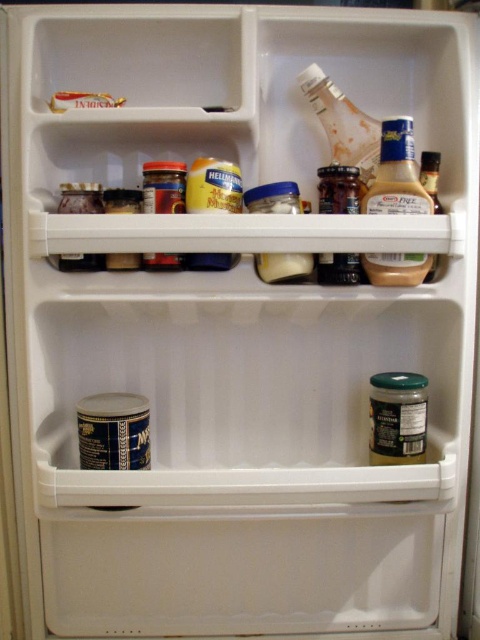
What is located at the coordinates point (274, 198) in the refrigerator?

The point (274, 198) marks a matte plastic jar at center.

You are looking at the refrigerator shelves from the front. There are two points marked on the shelves, point 1 at (59, 97) and point 2 at (435, 180). Which point is closer to you?

Point 1 at (59, 97) is closer to you because it is closer to the camera than point 2 at (435, 180).

You are a delivery person who needs to place a 70 cm long package on the refrigerator shelf. The package must be placed at the point marked as point [287,280]. Can the package fit on the refrigerator shelf at that point without exceeding the shelf depth?

The distance of point [287,280] from the camera is 73.79 centimeters. Since the package is 70 cm long, it can fit at that point as the depth available is greater than the package length.